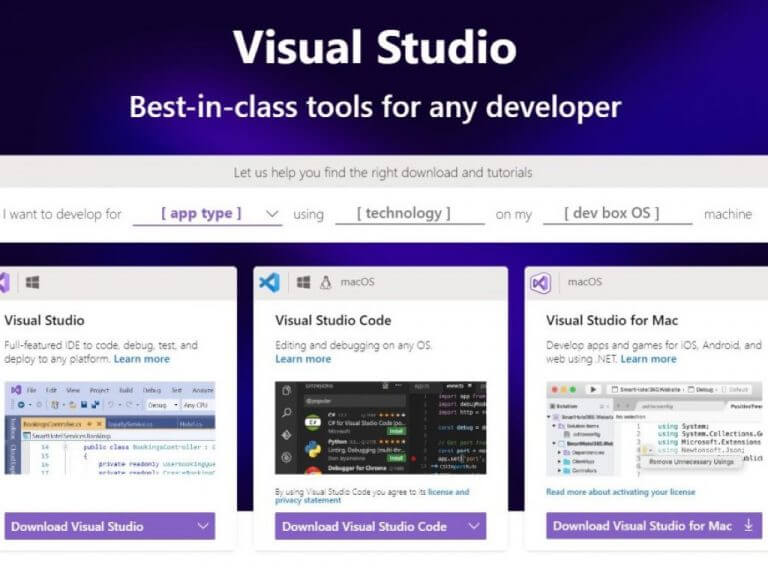
Locate an element on the screen. The width and height of the screenshot is (768, 576). computer screen image is located at coordinates (114, 439), (362, 419), (597, 469).